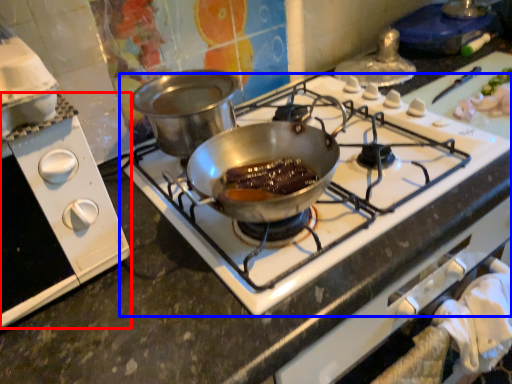
Question: Among these objects, which one is nearest to the camera, kitchen appliance (highlighted by a red box) or gas stove (highlighted by a blue box)?

Choices:
 (A) kitchen appliance
 (B) gas stove

Answer: (A)